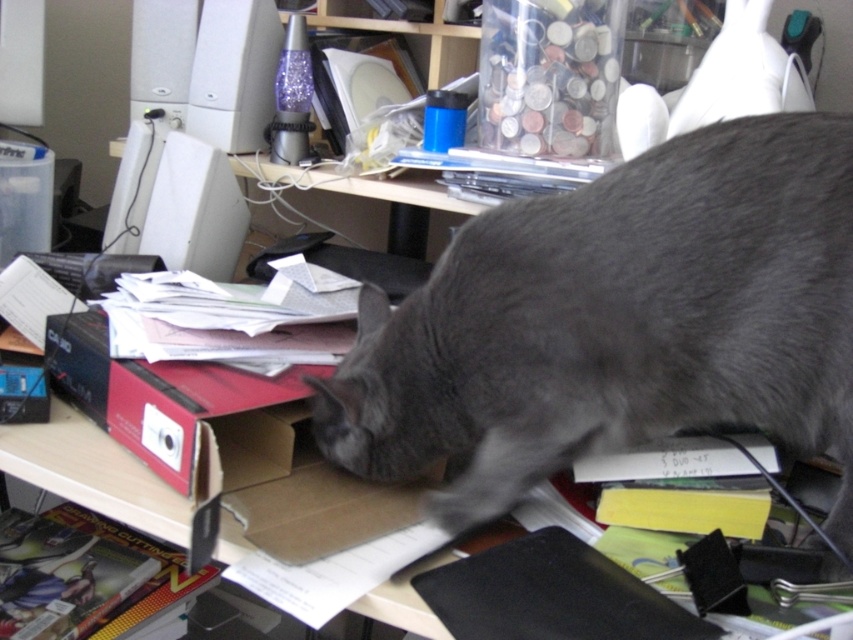
Question: Does gray fur cat at center come in front of white plastic computer at upper left?

Choices:
 (A) yes
 (B) no

Answer: (A)

Question: From the image, what is the correct spatial relationship of gray fur cat at center in relation to white plastic computer at upper left?

Choices:
 (A) left
 (B) right

Answer: (B)

Question: Which of the following is the farthest from the observer?

Choices:
 (A) (476, 314)
 (B) (131, 186)

Answer: (B)

Question: Does gray fur cat at center appear on the left side of white plastic computer at upper left?

Choices:
 (A) no
 (B) yes

Answer: (A)

Question: Which point is closer to the camera?

Choices:
 (A) (642, 408)
 (B) (177, 248)

Answer: (A)